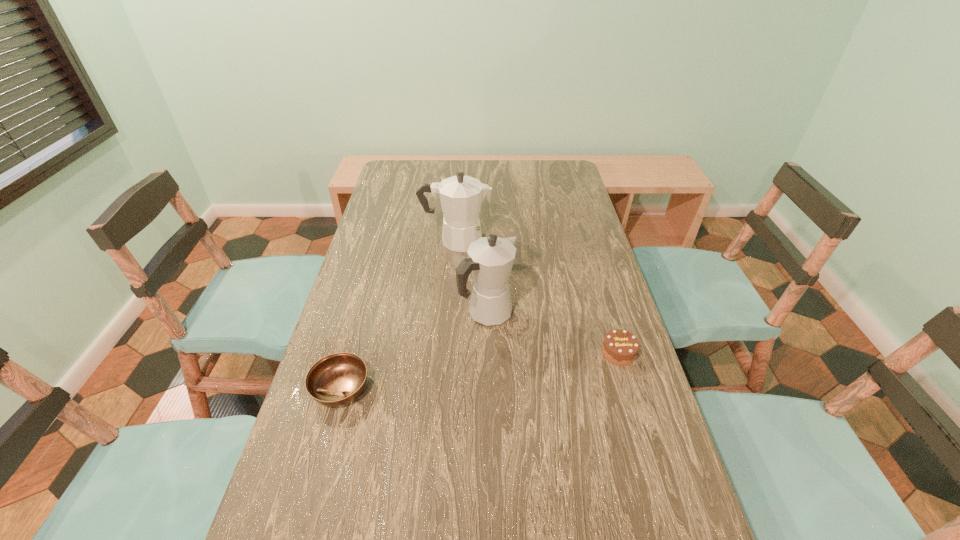
Where is `object that is at the left edge`? Image resolution: width=960 pixels, height=540 pixels. object that is at the left edge is located at coordinates (x=337, y=379).

At what (x,y) coordinates should I click in order to perform the action: click on object at the right edge. Please return your answer as a coordinate pair (x, y). Looking at the image, I should click on (620, 347).

Where is `free space at the far edge of the desktop`? free space at the far edge of the desktop is located at coordinates pos(439,181).

You are a GUI agent. You are given a task and a screenshot of the screen. Output one action in this format:
    pyautogui.click(x=<x>, y=<y>)
    Task: Click on the vacant point at the left edge
    The height and width of the screenshot is (540, 960).
    Given the screenshot: What is the action you would take?
    (344, 503)

At what (x,y) coordinates should I click in order to perform the action: click on vacant space at the right edge of the desktop. Please return your answer as a coordinate pair (x, y). This screenshot has height=540, width=960. Looking at the image, I should click on (565, 245).

In order to click on free space at the far left corner of the desktop in this screenshot , I will do `click(406, 176)`.

Image resolution: width=960 pixels, height=540 pixels. What are the coordinates of `blank space at the far right corner` in the screenshot? It's located at (566, 187).

Image resolution: width=960 pixels, height=540 pixels. I want to click on free area in between the farthest object and the nearer coffeepot, so click(471, 277).

Where is `free space between the third nearest object and the soup bowl`? This screenshot has height=540, width=960. free space between the third nearest object and the soup bowl is located at coordinates (414, 352).

Find the location of a particular element. Image resolution: width=960 pixels, height=540 pixels. free space between the farther coffeepot and the nearer coffeepot is located at coordinates (471, 277).